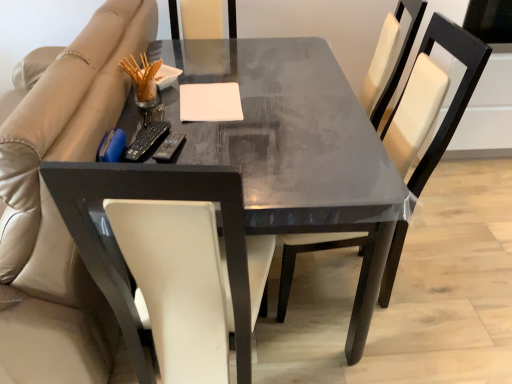
Image resolution: width=512 pixels, height=384 pixels. In order to click on vacant area located to the right-hand side of matte black table at center in this screenshot , I will do `click(453, 266)`.